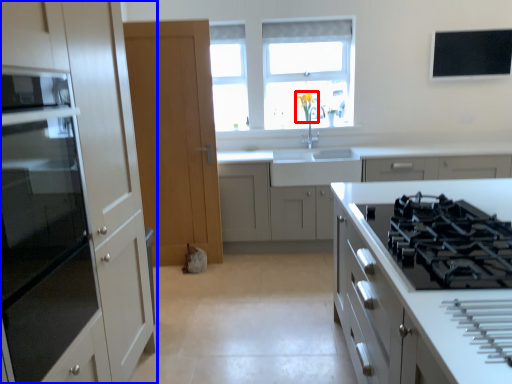
Question: Which of the following is the farthest to the observer, flower (highlighted by a red box) or cabinetry (highlighted by a blue box)?

Choices:
 (A) flower
 (B) cabinetry

Answer: (A)